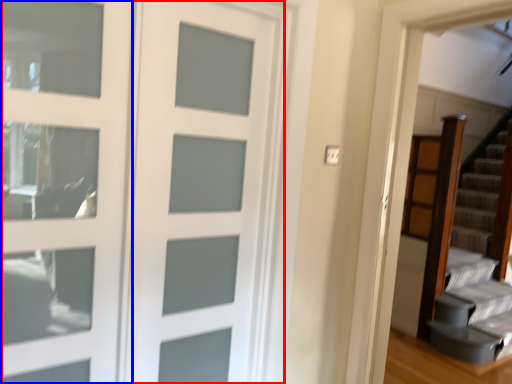
Question: Which of the following is the closest to the observer, door (highlighted by a red box) or screen door (highlighted by a blue box)?

Choices:
 (A) door
 (B) screen door

Answer: (B)